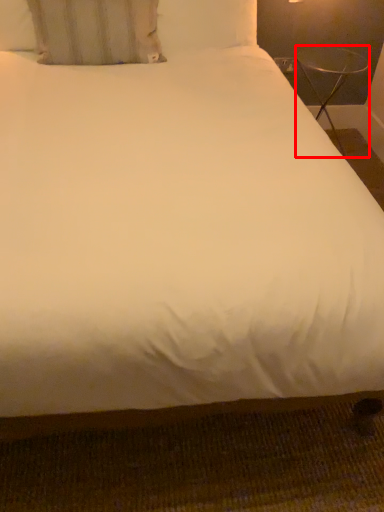
Question: In this image, where is table (annotated by the red box) located relative to pillow?

Choices:
 (A) left
 (B) right

Answer: (B)